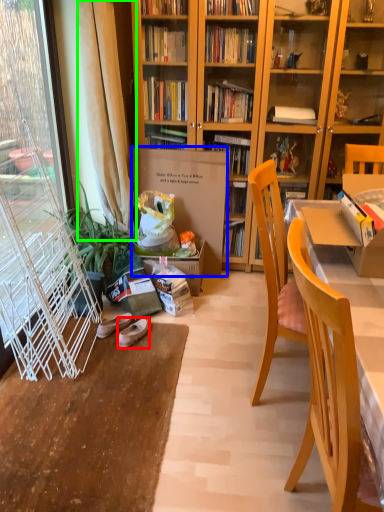
Question: Which object is positioned farthest from footwear (highlighted by a red box)? Select from cardboard box (highlighted by a blue box) and curtain (highlighted by a green box).

Choices:
 (A) cardboard box
 (B) curtain

Answer: (B)